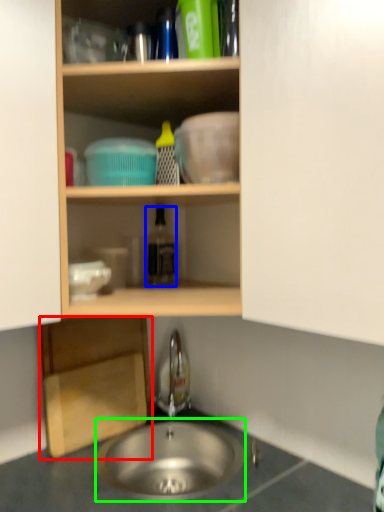
Question: Estimate the real-world distances between objects in this image. Which object is farther from cabinetry (highlighted by a red box), bottle (highlighted by a blue box) or sink (highlighted by a green box)?

Choices:
 (A) bottle
 (B) sink

Answer: (A)